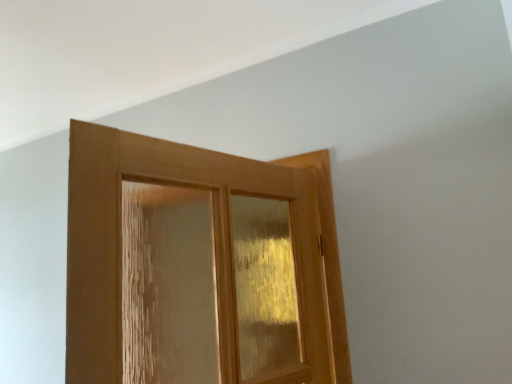
Image resolution: width=512 pixels, height=384 pixels. Find the location of `wooden door at center`. wooden door at center is located at coordinates (199, 266).

What do you see at coordinates (199, 266) in the screenshot? Image resolution: width=512 pixels, height=384 pixels. I see `wooden door at center` at bounding box center [199, 266].

At what (x,y) coordinates should I click in order to perform the action: click on wooden door at center. Please return your answer as a coordinate pair (x, y). This screenshot has width=512, height=384. Looking at the image, I should click on (199, 266).